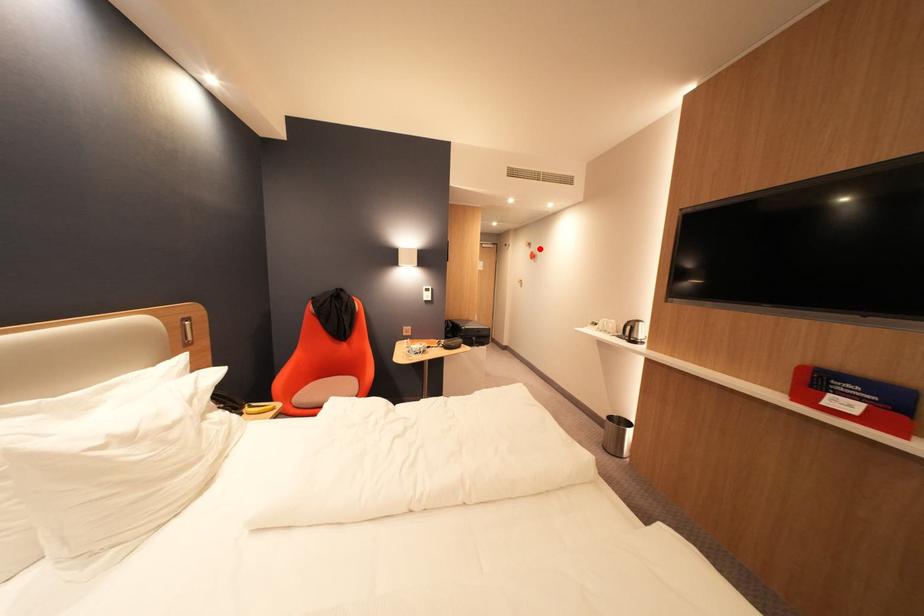
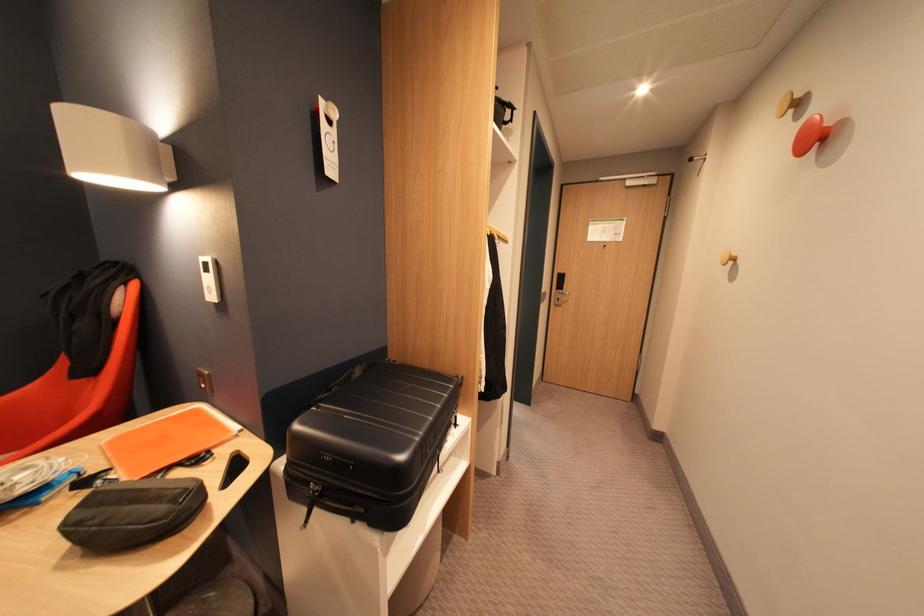
Where in the second image is the point corresponding to the highlighted location from the first image?

(809, 118)